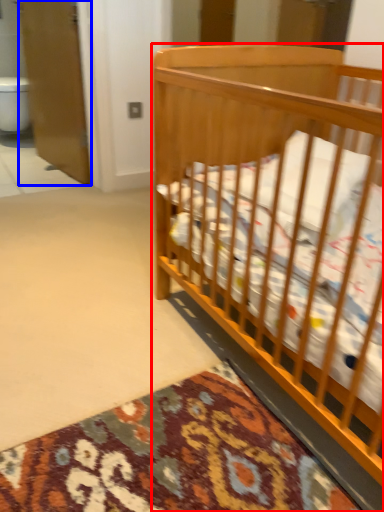
Question: Which object appears farthest to the camera in this image, infant bed (highlighted by a red box) or screen door (highlighted by a blue box)?

Choices:
 (A) infant bed
 (B) screen door

Answer: (B)